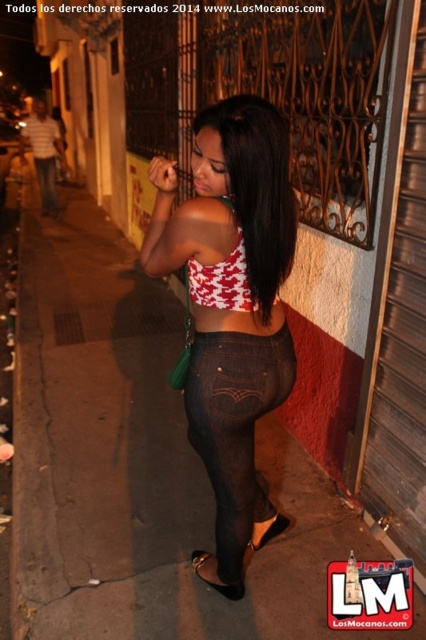
Question: Which object is positioned closest to the jeans at left?

Choices:
 (A) black silky hair at center
 (B) black mesh leggings at center
 (C) white striped shirt at upper left
 (D) matte red and white top at center

Answer: (C)

Question: Is black mesh leggings at center further to camera compared to jeans at left?

Choices:
 (A) yes
 (B) no

Answer: (B)

Question: Is matte red and white top at center further to the viewer compared to white printed fabric bikini top at center?

Choices:
 (A) no
 (B) yes

Answer: (A)

Question: Which point is closer to the camera taking this photo?

Choices:
 (A) (51, 132)
 (B) (43, 182)
 (C) (242, 148)
 (D) (187, 412)

Answer: (C)

Question: Which object is closer to the camera taking this photo?

Choices:
 (A) black patent leather sandal at lower center
 (B) white striped shirt at upper left
 (C) black silky hair at center

Answer: (C)

Question: Is white printed fabric bikini top at center thinner than white striped shirt at upper left?

Choices:
 (A) no
 (B) yes

Answer: (B)